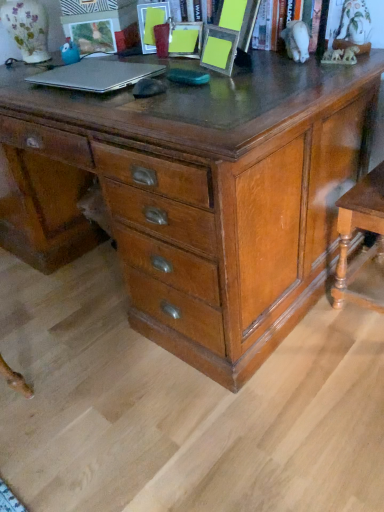
Question: Considering the relative sizes of wooden table at lower right and yellow paper at upper center in the image provided, is wooden table at lower right taller than yellow paper at upper center?

Choices:
 (A) no
 (B) yes

Answer: (B)

Question: Is wooden table at lower right next to yellow paper at upper center?

Choices:
 (A) yes
 (B) no

Answer: (B)

Question: Is wooden table at lower right facing towards yellow paper at upper center?

Choices:
 (A) no
 (B) yes

Answer: (A)

Question: Does wooden table at lower right have a lesser height compared to yellow paper at upper center?

Choices:
 (A) no
 (B) yes

Answer: (A)

Question: Is wooden table at lower right facing away from yellow paper at upper center?

Choices:
 (A) no
 (B) yes

Answer: (A)

Question: From the image's perspective, is wooden table at lower right over yellow paper at upper center?

Choices:
 (A) yes
 (B) no

Answer: (B)

Question: Does wooden table at lower right have a smaller size compared to matte plastic picture frame at upper center, which is the second picture frame in right-to-left order?

Choices:
 (A) no
 (B) yes

Answer: (A)

Question: Does wooden table at lower right turn towards matte plastic picture frame at upper center, which is the second picture frame in right-to-left order?

Choices:
 (A) yes
 (B) no

Answer: (B)

Question: Does wooden table at lower right have a lesser width compared to matte plastic picture frame at upper center, the 2th picture frame when ordered from left to right?

Choices:
 (A) yes
 (B) no

Answer: (B)

Question: Is wooden table at lower right positioned in front of matte plastic picture frame at upper center, which is the second picture frame in right-to-left order?

Choices:
 (A) yes
 (B) no

Answer: (A)

Question: Is wooden table at lower right positioned beyond the bounds of matte plastic picture frame at upper center, which is the second picture frame in right-to-left order?

Choices:
 (A) yes
 (B) no

Answer: (A)

Question: Is wooden table at lower right bigger than matte plastic picture frame at upper center, which is the second picture frame in right-to-left order?

Choices:
 (A) yes
 (B) no

Answer: (A)

Question: Does yellow paper at upper center have a lesser height compared to matte plastic picture frame at upper left, which is the first picture frame from left to right?

Choices:
 (A) yes
 (B) no

Answer: (B)